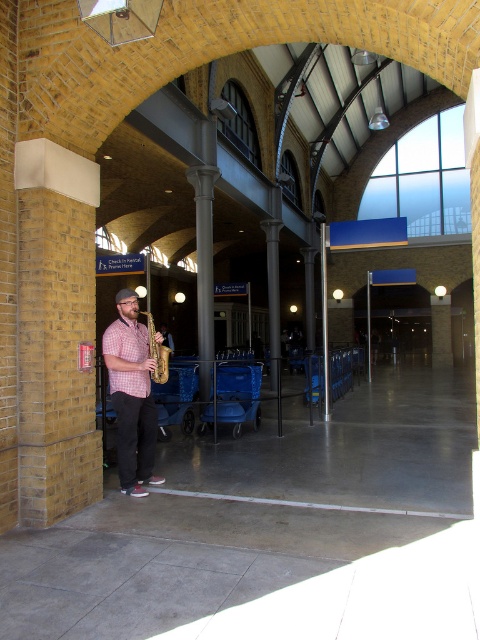
Question: Which of the following is the closest to the observer?

Choices:
 (A) (147, 413)
 (B) (168, 352)

Answer: (A)

Question: Is matte brown saxophone at center below shiny gold trumpet at center?

Choices:
 (A) no
 (B) yes

Answer: (B)

Question: Which point is closer to the camera?

Choices:
 (A) matte brown saxophone at center
 (B) shiny gold trumpet at center

Answer: (A)

Question: Can you confirm if matte brown saxophone at center is positioned to the right of shiny gold trumpet at center?

Choices:
 (A) no
 (B) yes

Answer: (A)

Question: Is matte brown saxophone at center above shiny gold trumpet at center?

Choices:
 (A) yes
 (B) no

Answer: (B)